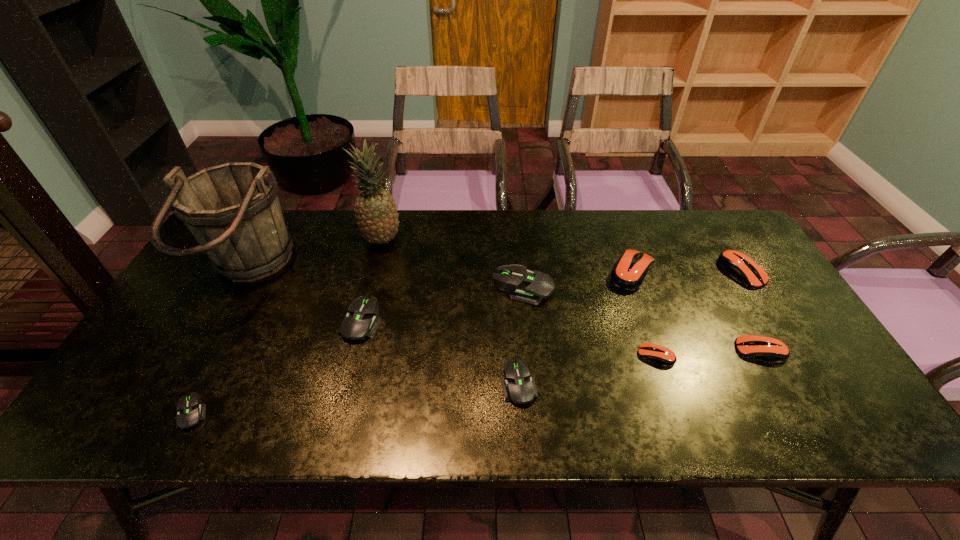
At what (x,y) coordinates should I click in order to perform the action: click on vacant region that satisfies the following two spatial constraints: 1. on the handle side of the bucket; 2. on the right side of the smallest gray computer mouse. Please return your answer as a coordinate pair (x, y). The height and width of the screenshot is (540, 960). Looking at the image, I should click on (171, 412).

This screenshot has height=540, width=960. I want to click on vacant area that satisfies the following two spatial constraints: 1. on the handle side of the biggest gray computer mouse; 2. on the right side of the bucket, so click(239, 288).

The width and height of the screenshot is (960, 540). I want to click on vacant space that satisfies the following two spatial constraints: 1. on the back side of the smallest orange computer mouse; 2. on the left side of the smallest gray computer mouse, so click(x=222, y=355).